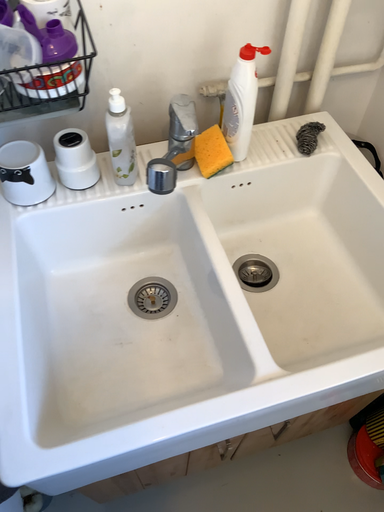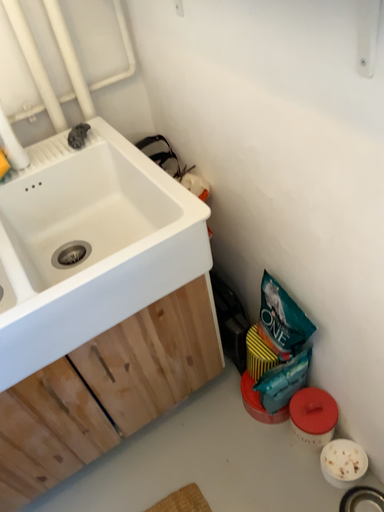
Question: Which way did the camera rotate in the video?

Choices:
 (A) rotated downward
 (B) rotated upward

Answer: (B)